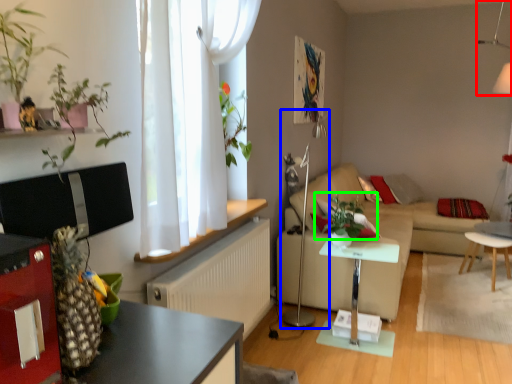
Question: Which object is the closest to the lamp (highlighted by a red box)? Choose among these: lamp (highlighted by a blue box) or plant (highlighted by a green box).

Choices:
 (A) lamp
 (B) plant

Answer: (B)